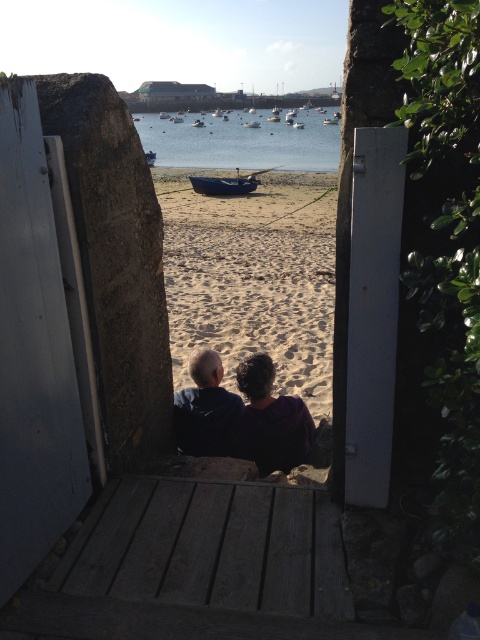
This screenshot has width=480, height=640. In order to click on sandy beach at center in this screenshot , I will do `click(252, 278)`.

Does sandy beach at center appear on the left side of blue wooden boat at center?

In fact, sandy beach at center is to the right of blue wooden boat at center.

Which is in front, point (214, 300) or point (195, 120)?

Point (214, 300) is more forward.

Image resolution: width=480 pixels, height=640 pixels. I want to click on sandy beach at center, so click(x=252, y=278).

Who is more distant from viewer, (282, 212) or (201, 400)?

Point (282, 212)

Which is above, sandy beach at center or dark blue hoodie at center?

sandy beach at center is above.

What do you see at coordinates (252, 278) in the screenshot? I see `sandy beach at center` at bounding box center [252, 278].

This screenshot has width=480, height=640. I want to click on sandy beach at center, so click(252, 278).

Can you confirm if sandy beach at center is smaller than clear blue water at center?

Yes.

Which is more to the right, sandy beach at center or clear blue water at center?

Positioned to the right is clear blue water at center.

Is point (282, 312) in front of point (254, 120)?

Yes, point (282, 312) is in front of point (254, 120).

In order to click on sandy beach at center in this screenshot , I will do `click(252, 278)`.